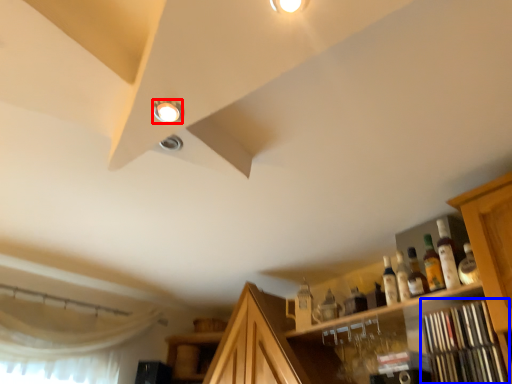
Question: Which point is closer to the camera, droplight (highlighted by a red box) or shelf (highlighted by a blue box)?

Choices:
 (A) droplight
 (B) shelf

Answer: (A)